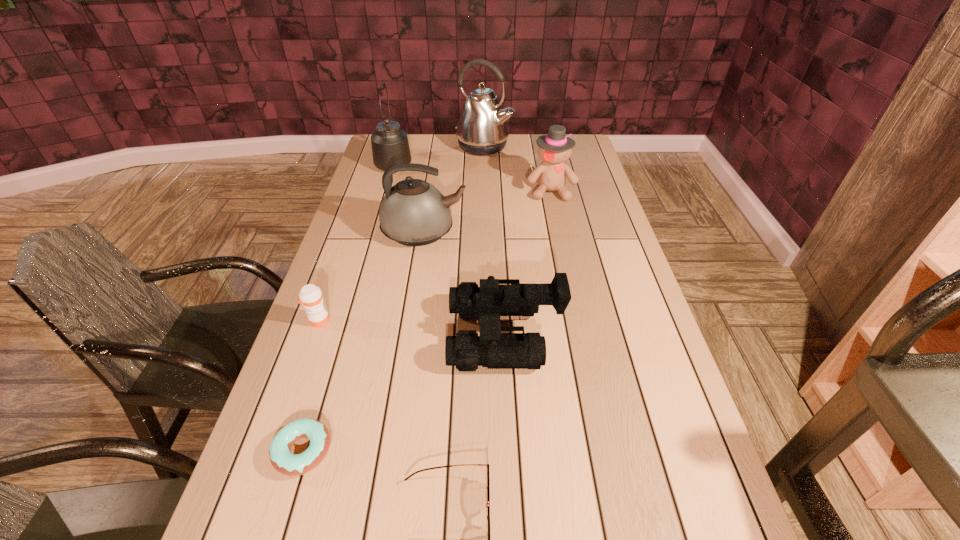
Identify the location of vacant region located 0.250m on the front lenses of the binoculars. (348, 335).

The height and width of the screenshot is (540, 960). Identify the location of vacant space situated 0.180m on the front of the third shortest object. (294, 392).

This screenshot has width=960, height=540. Find the location of `vacant space located on the back of the doughnut`. vacant space located on the back of the doughnut is located at coordinates (339, 332).

Find the location of a particular element. The image size is (960, 540). medicine that is positioned at the left edge is located at coordinates (310, 295).

Find the location of a particular element. doughnut that is at the left edge is located at coordinates (285, 462).

Find the location of a particular element. The image size is (960, 540). object that is at the right edge is located at coordinates (554, 149).

At what (x,y) coordinates should I click in order to perform the action: click on object located at the far left corner. Please return your answer as a coordinate pair (x, y). Looking at the image, I should click on (390, 146).

Where is `vacant space at the left edge of the desktop`? vacant space at the left edge of the desktop is located at coordinates (x=289, y=394).

The height and width of the screenshot is (540, 960). I want to click on blank space at the right edge of the desktop, so click(644, 410).

In order to click on free space at the far right corner of the desktop in this screenshot , I will do (592, 162).